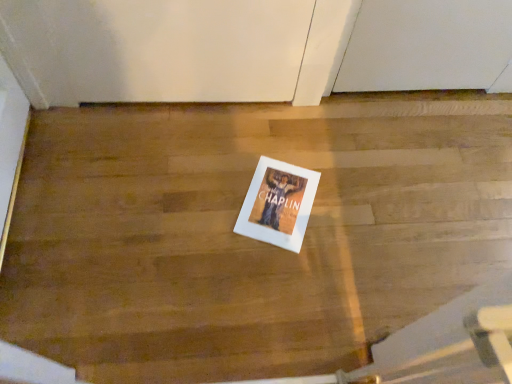
Image resolution: width=512 pixels, height=384 pixels. I want to click on free spot to the right of white paper at center, so click(339, 215).